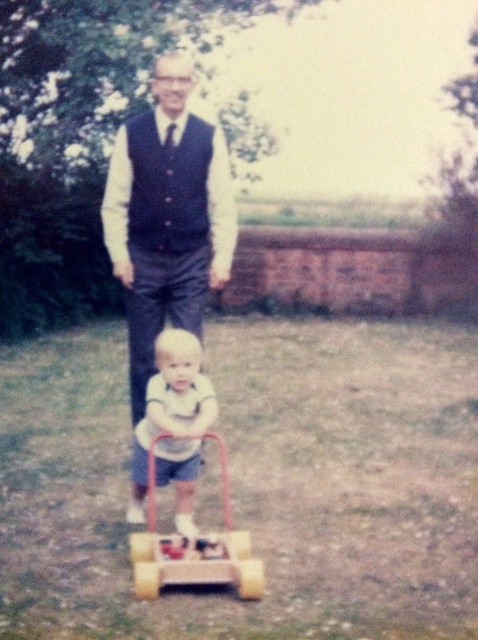
Between dark blue textured vest at center and smooth white shirt at center, which one appears on the left side from the viewer's perspective?

dark blue textured vest at center is more to the left.

Which is in front, point (175, 61) or point (212, 392)?

Point (212, 392) is in front.

At what (x,y) coordinates should I click in order to perform the action: click on dark blue textured vest at center. Please return your answer as a coordinate pair (x, y). The width and height of the screenshot is (478, 640). Looking at the image, I should click on (166, 218).

Is smooth white shirt at center above dark blue fabric vest at center?

Actually, smooth white shirt at center is below dark blue fabric vest at center.

Is smooth white shirt at center wider than dark blue fabric vest at center?

Correct, the width of smooth white shirt at center exceeds that of dark blue fabric vest at center.

Who is more forward, (162, 432) or (184, 230)?

Point (162, 432) is in front.

At what (x,y) coordinates should I click in order to perform the action: click on smooth white shirt at center. Please return your answer as a coordinate pair (x, y). The height and width of the screenshot is (640, 478). Looking at the image, I should click on (173, 426).

Between point (151, 168) and point (145, 536), which one is positioned in front?

Point (145, 536) is more forward.

This screenshot has height=640, width=478. What do you see at coordinates (169, 186) in the screenshot? I see `dark blue fabric vest at center` at bounding box center [169, 186].

This screenshot has height=640, width=478. I want to click on dark blue fabric vest at center, so click(169, 186).